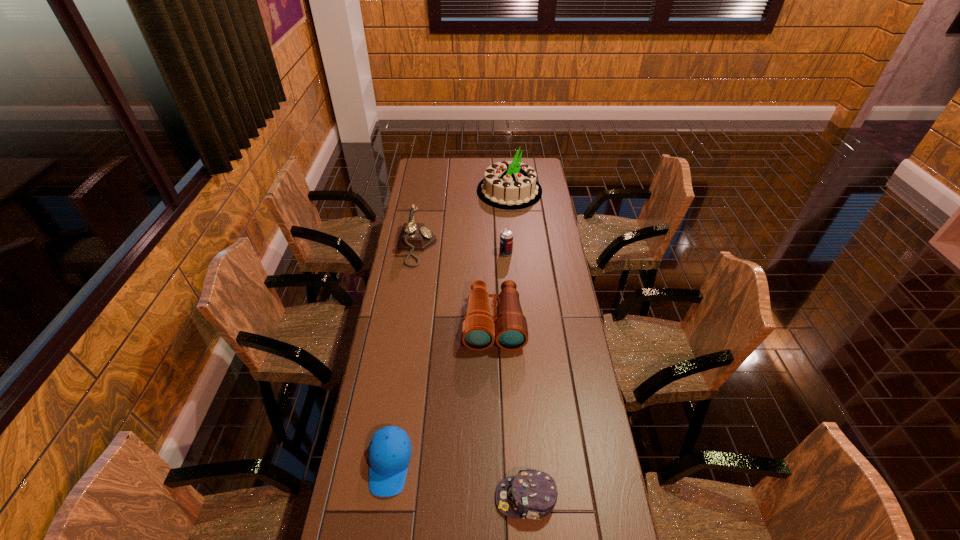
Find the location of a particular element. The height and width of the screenshot is (540, 960). object that is at the far right corner is located at coordinates (511, 185).

I want to click on free space at the far edge of the desktop, so click(x=501, y=161).

At what (x,y) coordinates should I click in order to perform the action: click on free region at the left edge of the desktop. Please return your answer as a coordinate pair (x, y). Looking at the image, I should click on (395, 285).

In the image, there is a desktop. At what (x,y) coordinates should I click in order to perform the action: click on vacant space at the right edge. Please return your answer as a coordinate pair (x, y). The height and width of the screenshot is (540, 960). Looking at the image, I should click on (558, 312).

In the image, there is a desktop. Identify the location of free space at the far left corner. The height and width of the screenshot is (540, 960). (420, 172).

At what (x,y) coordinates should I click in order to perform the action: click on vacant space at the far right corner of the desktop. Please return your answer as a coordinate pair (x, y). The height and width of the screenshot is (540, 960). Looking at the image, I should click on (523, 160).

I want to click on vacant point located between the farthest object and the second tallest object, so click(x=464, y=219).

Identify the location of vacant area between the farthest object and the left headwear. (x=449, y=327).

Locate an element on the screen. This screenshot has height=540, width=960. free area in between the left headwear and the tallest object is located at coordinates (449, 327).

Identify the location of vacant space in between the left headwear and the tallest object. (449, 327).